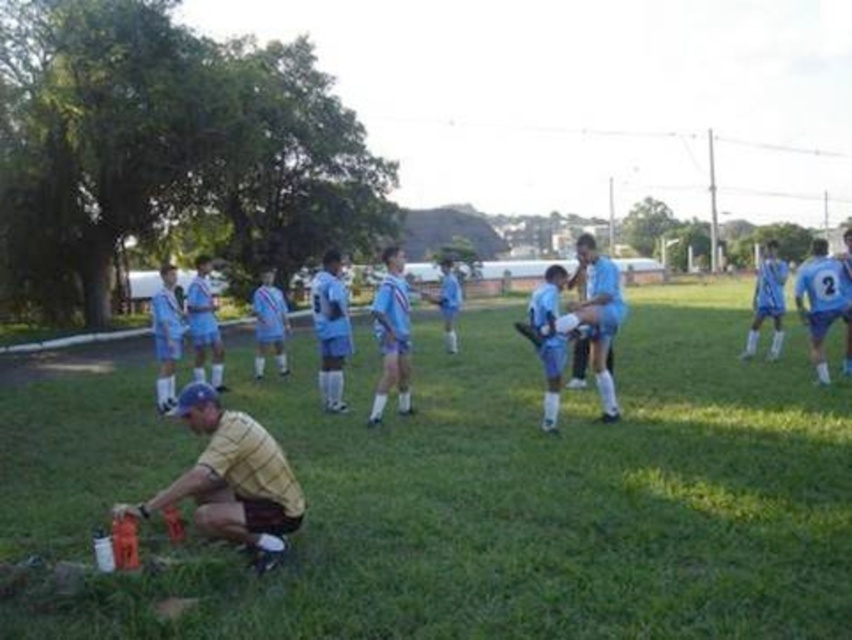
Is yellow plaid shirt at lower left above light blue fabric shorts at center?

No.

Can you confirm if yellow plaid shirt at lower left is positioned to the right of light blue fabric shorts at center?

No, yellow plaid shirt at lower left is not to the right of light blue fabric shorts at center.

Who is more forward, (x=255, y=522) or (x=579, y=241)?

Positioned in front is point (x=255, y=522).

Locate an element on the screen. The width and height of the screenshot is (852, 640). yellow plaid shirt at lower left is located at coordinates (231, 480).

Between green grass at lower center and yellow plaid shirt at lower left, which one has more height?

yellow plaid shirt at lower left is taller.

Does green grass at lower center have a larger size compared to yellow plaid shirt at lower left?

Indeed, green grass at lower center has a larger size compared to yellow plaid shirt at lower left.

What do you see at coordinates (534, 500) in the screenshot?
I see `green grass at lower center` at bounding box center [534, 500].

You are a GUI agent. You are given a task and a screenshot of the screen. Output one action in this format:
    pyautogui.click(x=<x>, y=<y>)
    Task: Click on the green grass at lower center
    This screenshot has height=640, width=852.
    Given the screenshot: What is the action you would take?
    pyautogui.click(x=534, y=500)

Between green grass at lower center and light blue fabric uniform at center, which one appears on the right side from the viewer's perspective?

light blue fabric uniform at center is more to the right.

Is point (268, 387) positioned in front of point (404, 296)?

No, it is not.

The height and width of the screenshot is (640, 852). In order to click on green grass at lower center in this screenshot , I will do `click(534, 500)`.